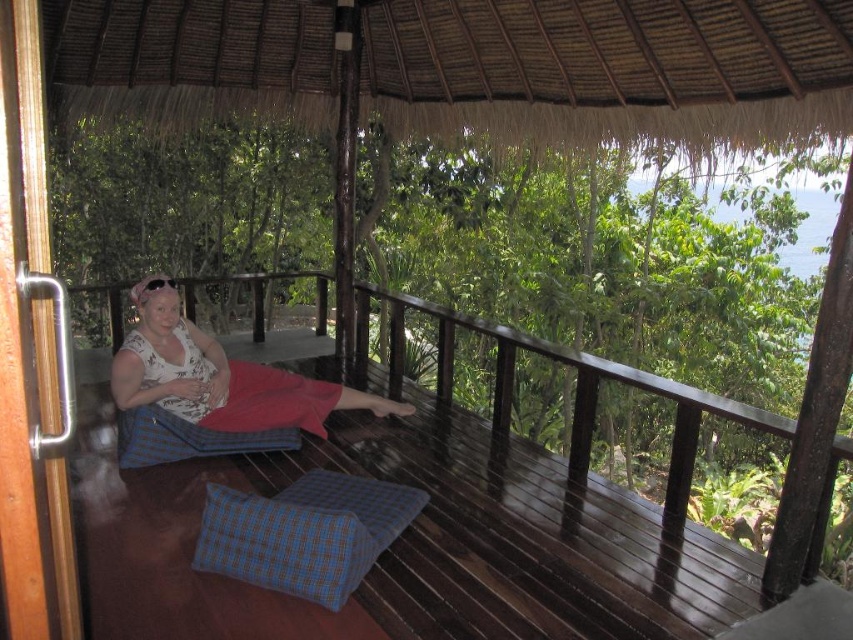
Is thatched straw roof at upper center further to the viewer compared to blue checkered pillow at lower center?

That is True.

Between thatched straw roof at upper center and blue checkered pillow at lower center, which one is positioned lower?

Positioned lower is blue checkered pillow at lower center.

Who is more distant from viewer, (761, 81) or (206, 556)?

The point (761, 81) is more distant.

The image size is (853, 640). Find the location of `thatched straw roof at upper center`. thatched straw roof at upper center is located at coordinates (608, 67).

How much distance is there between matte white blouse at center and blue checkered pillow at lower center?

1.11 meters

Does matte white blouse at center appear under blue checkered pillow at lower center?

Incorrect, matte white blouse at center is not positioned below blue checkered pillow at lower center.

Measure the distance between matte white blouse at center and camera.

matte white blouse at center and camera are 3.74 meters apart from each other.

The image size is (853, 640). In order to click on matte white blouse at center in this screenshot , I will do `click(219, 376)`.

Who is positioned more to the left, thatched straw roof at upper center or matte white blouse at center?

matte white blouse at center is more to the left.

Is thatched straw roof at upper center positioned before matte white blouse at center?

Yes.

The image size is (853, 640). I want to click on thatched straw roof at upper center, so click(x=608, y=67).